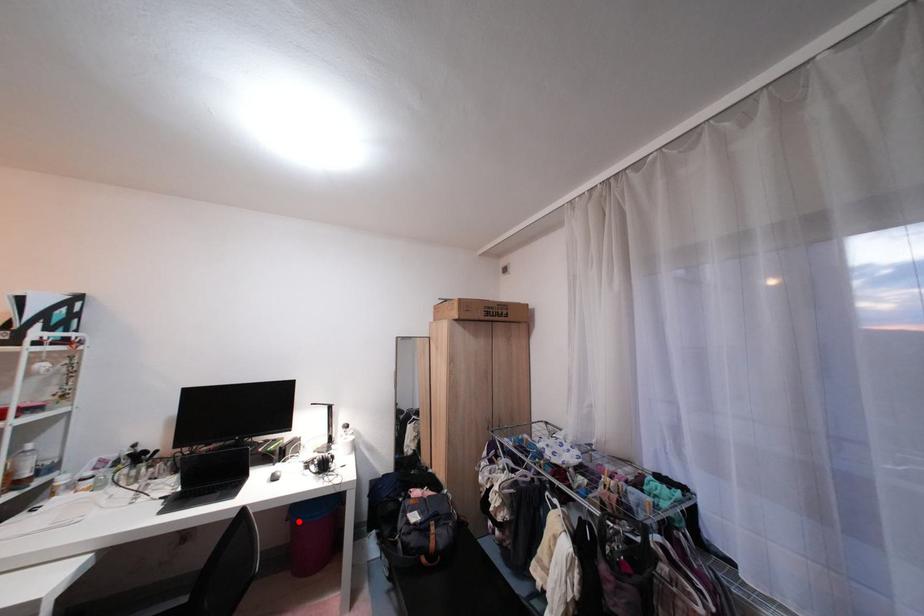
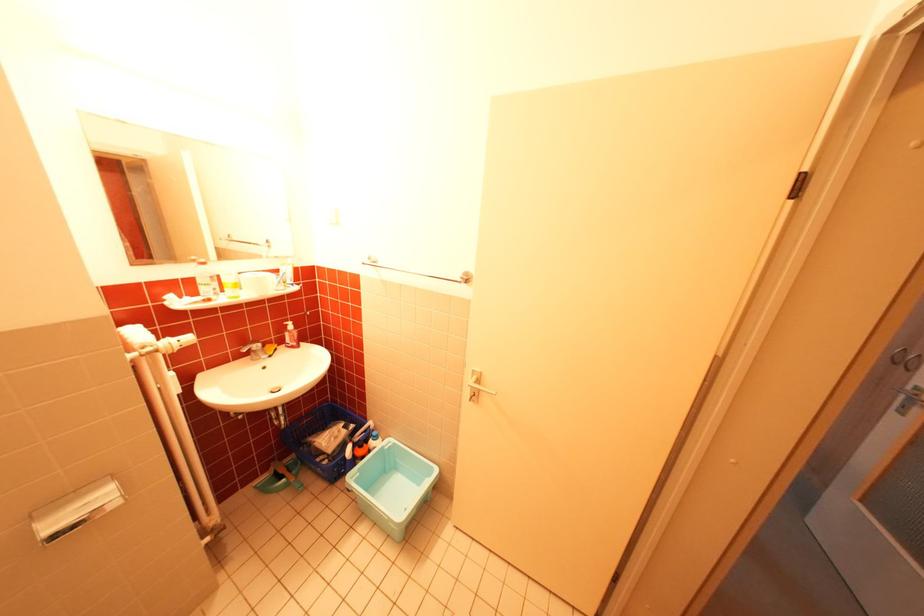
Question: I am providing you with two images of the same scene from different viewpoints. A red point is marked on the first image. Is the red point's position out of view in image 2?

Choices:
 (A) Yes
 (B) No

Answer: (A)